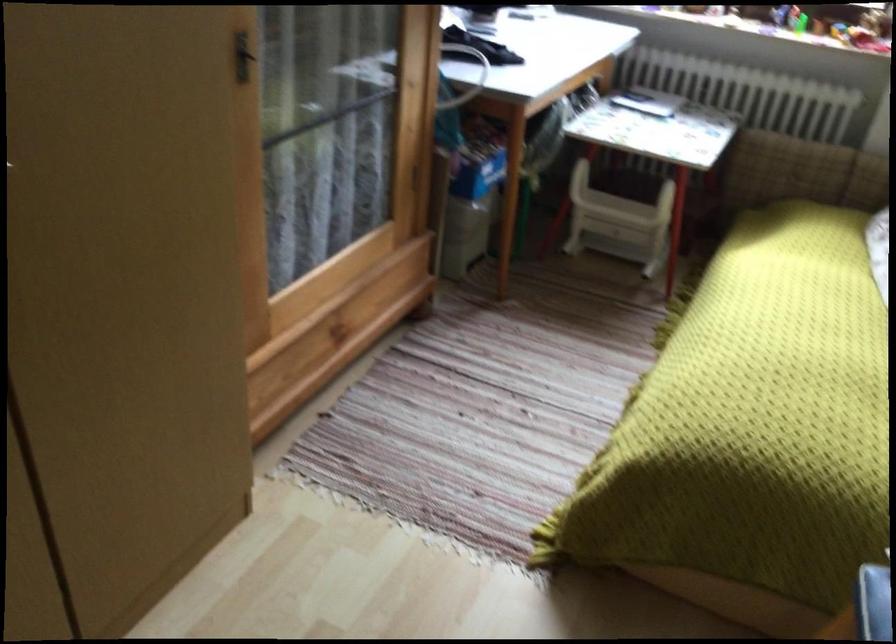
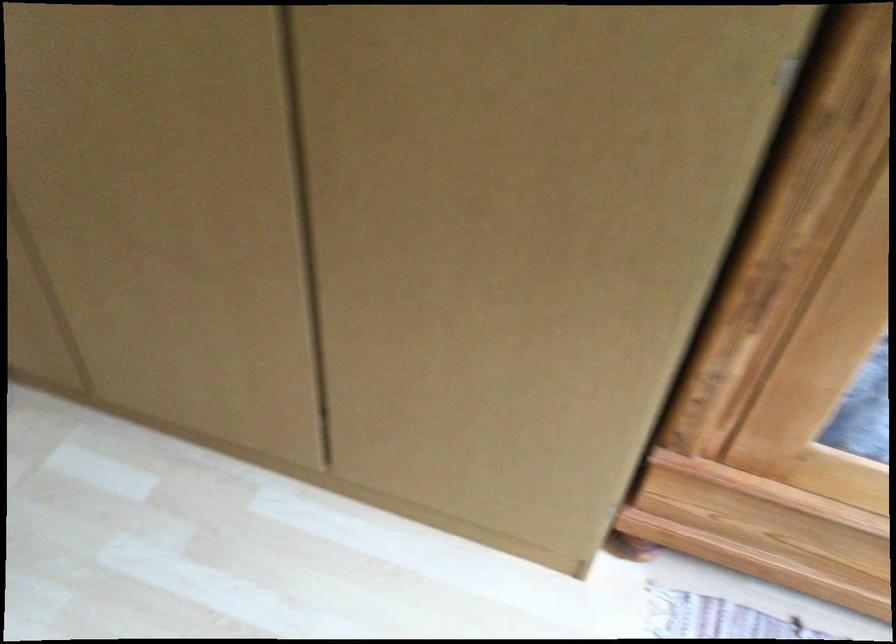
The images are taken continuously from a first-person perspective. In which direction is your viewpoint rotating?

The camera's rotation is toward left-down.